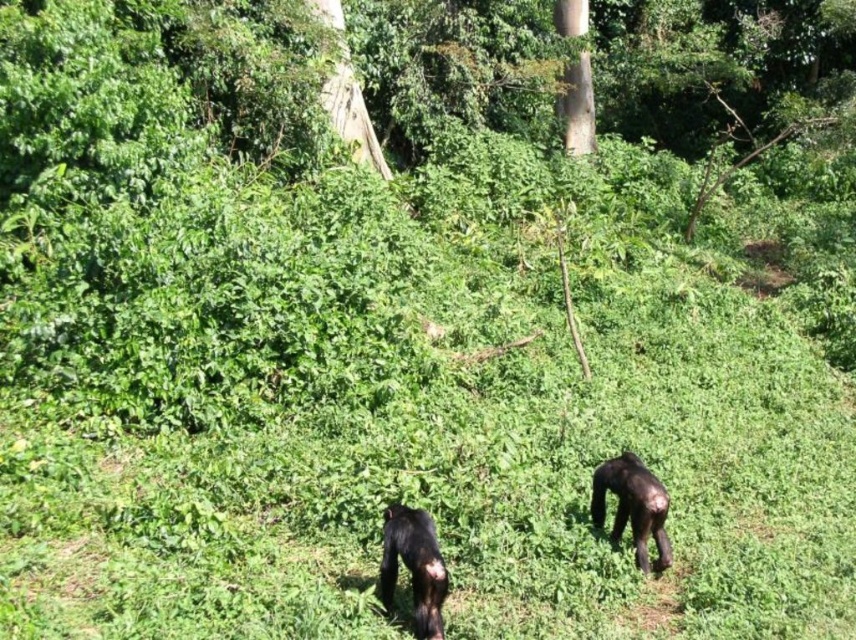
You are a wildlife photographer positioned at the origin point of the coordinate system. You want to capture a closeup shot of the shiny dark brown chimpanzee at lower center. Given that your camera has a focal length of 200mm and you need to be within 10 meters to get a clear image, can you determine if you are within range based on its coordinates?

The shiny dark brown chimpanzee at lower center is located at point (413, 566). To determine the distance, we calculate the Euclidean distance from the origin using the coordinates. The distance is sqrt0.886 squared plus 0.484 squared equals approximately sqrt0.785 plus 0.234 equals sqrt1.019 equals approximately 1.009 meters. Since this is within the 10 meter range, the photographer can take the closeup shot.